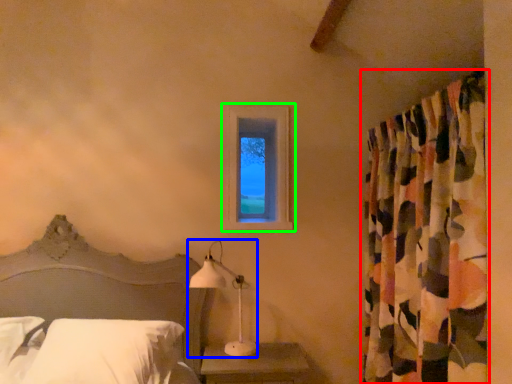
Question: Estimate the real-world distances between objects in this image. Which object is farther from curtain (highlighted by a red box), table lamp (highlighted by a blue box) or window (highlighted by a green box)?

Choices:
 (A) table lamp
 (B) window

Answer: (A)